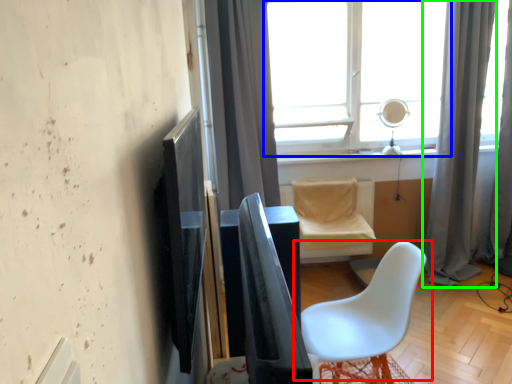
Question: Which object is positioned closest to chair (highlighted by a red box)? Select from window (highlighted by a blue box) and curtain (highlighted by a green box).

Choices:
 (A) window
 (B) curtain

Answer: (B)